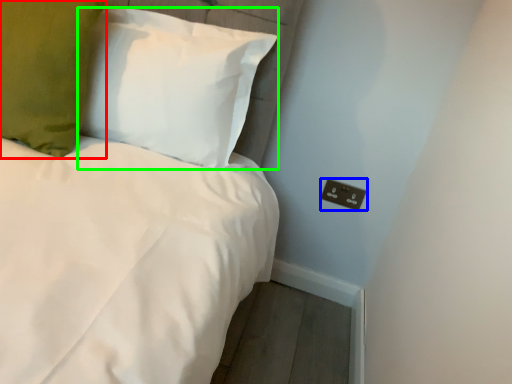
Question: Based on their relative distances, which object is farther from pillow (highlighted by a red box)? Choose from electric outlet (highlighted by a blue box) and pillow (highlighted by a green box).

Choices:
 (A) electric outlet
 (B) pillow

Answer: (A)